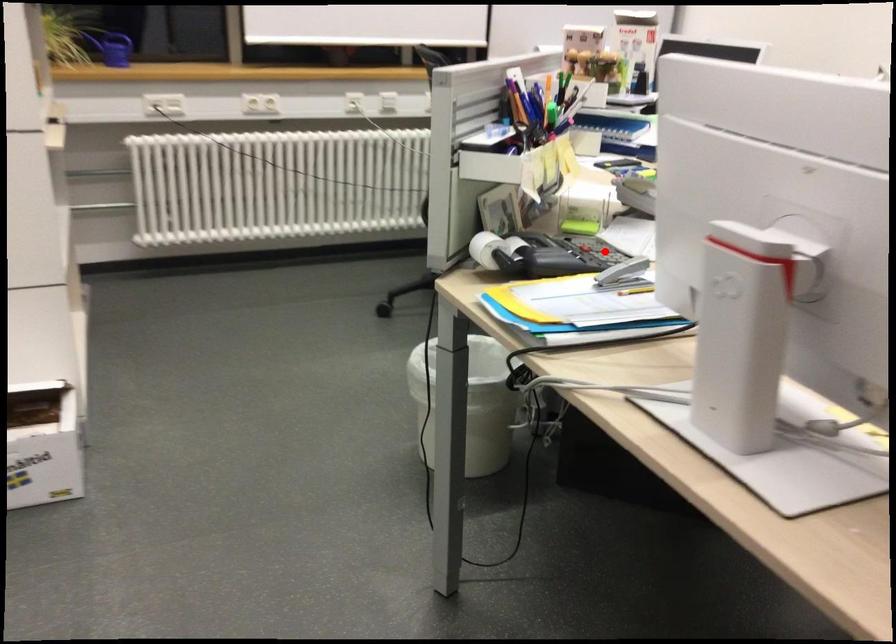
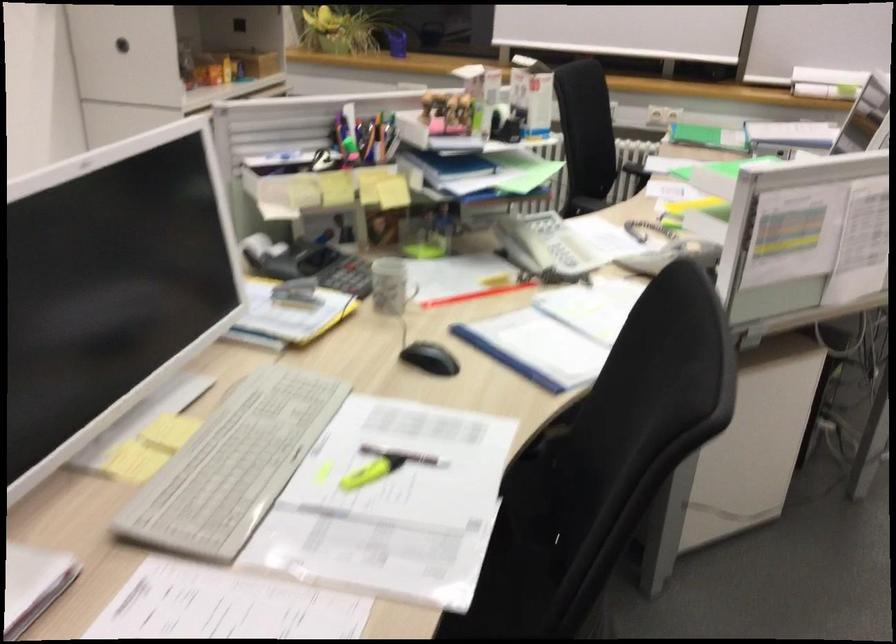
Question: I am providing you with two images of the same scene from different viewpoints. Image1 has a red point marked. In image2, the corresponding 3D location appears at what relative position? Reply with the corresponding letter.

Choices:
 (A) Closer
 (B) Farther

Answer: (B)